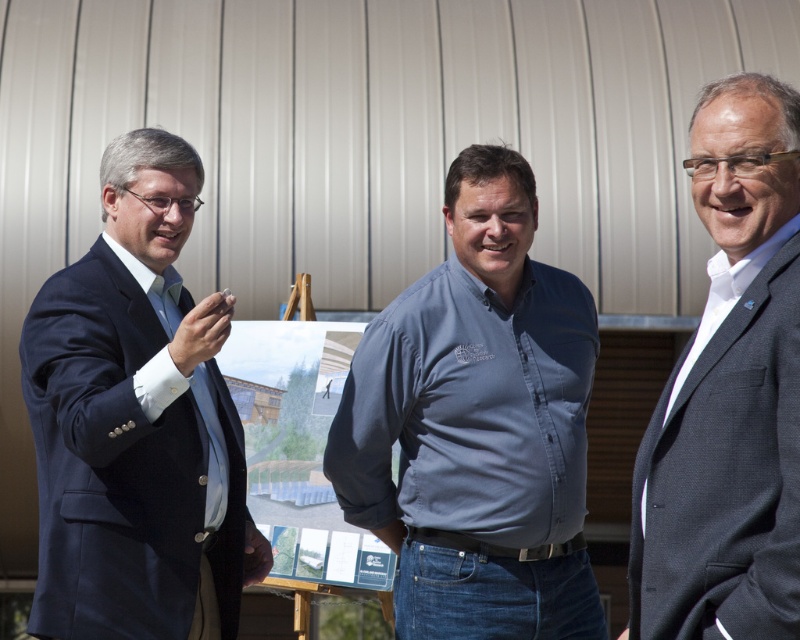
Can you confirm if dark gray suit at center is wider than matte blue tie at left?

Yes, dark gray suit at center is wider than matte blue tie at left.

Does dark gray suit at center have a larger size compared to matte blue tie at left?

Yes, dark gray suit at center is bigger than matte blue tie at left.

Find the location of a particular element. dark gray suit at center is located at coordinates (730, 394).

The width and height of the screenshot is (800, 640). Find the location of `dark gray suit at center`. dark gray suit at center is located at coordinates (730, 394).

Describe the element at coordinates (478, 426) in the screenshot. I see `blue cotton shirt at center` at that location.

Describe the element at coordinates (478, 426) in the screenshot. The width and height of the screenshot is (800, 640). I see `blue cotton shirt at center` at that location.

Image resolution: width=800 pixels, height=640 pixels. Find the location of `blue cotton shirt at center`. blue cotton shirt at center is located at coordinates (478, 426).

Is point (104, 605) closer to viewer compared to point (750, 406)?

No, it is not.

Based on the photo, which of these two, dark blue suit at left or dark gray suit at center, stands shorter?

dark gray suit at center

Identify the location of dark blue suit at left. (136, 422).